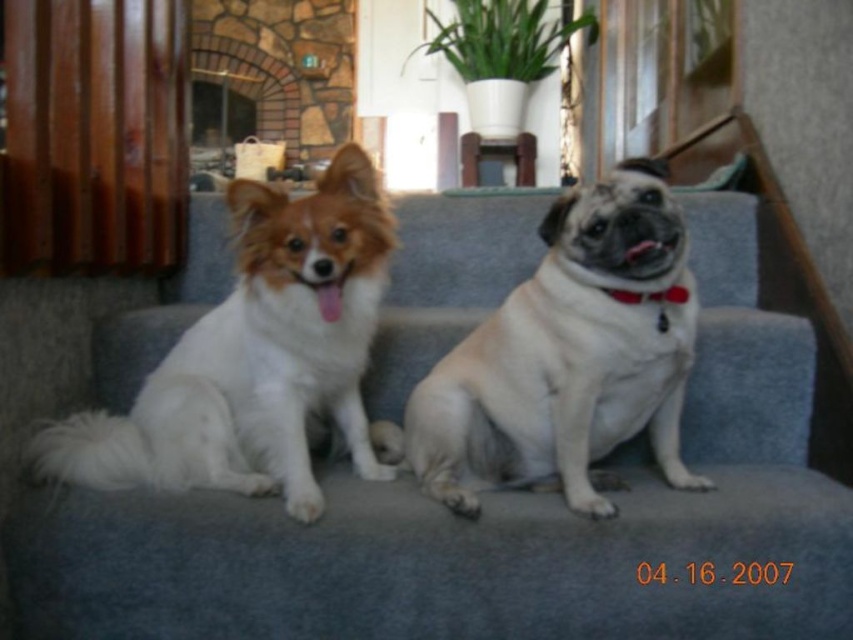
You are trying to place a new rug in the living room where the gray fabric couch at center is located. The rug needs to be placed directly below the couch. What are the coordinates where you should position the rug?

The coordinates to position the rug directly below the gray fabric couch at center would be the same x coordinate of 0.822 and a y coordinate slightly lower than 0.578, but since the exact placement depends on the rug size, the base point would be approximately at the couch location.